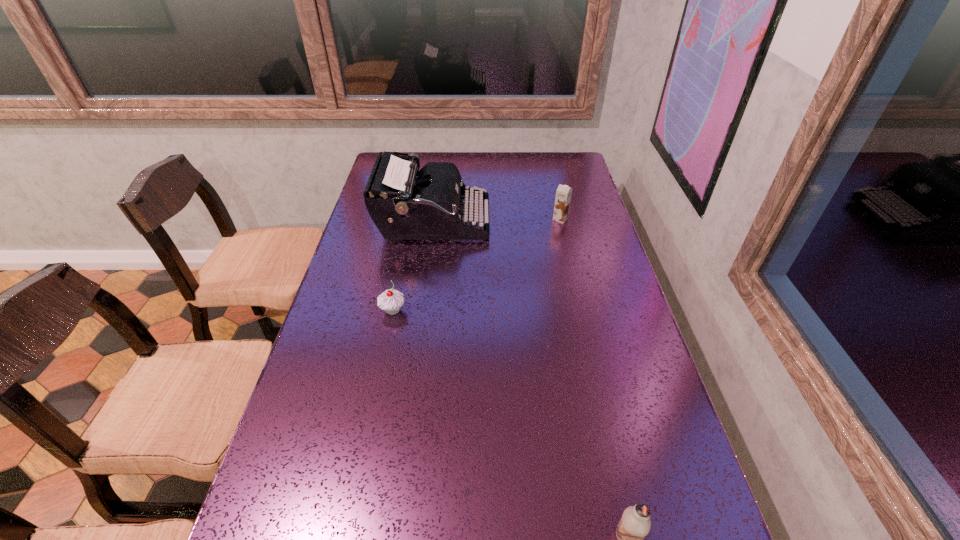
You are a GUI agent. You are given a task and a screenshot of the screen. Output one action in this format:
    pyautogui.click(x=<x>, y=<y>)
    Task: Click on the typewriter
    
    Given the screenshot: What is the action you would take?
    pyautogui.click(x=405, y=203)

Image resolution: width=960 pixels, height=540 pixels. I want to click on the farther chocolate milk, so click(x=563, y=193).

The height and width of the screenshot is (540, 960). Identify the location of cupcake. (391, 300).

Locate an element on the screen. The image size is (960, 540). free spot located 0.080m on the typing side of the typewriter is located at coordinates (512, 222).

I want to click on vacant space located 0.310m on the left of the farther chocolate milk, so click(464, 219).

Identify the location of vacant space situated 0.220m on the front of the second nearest object. The height and width of the screenshot is (540, 960). (377, 390).

Where is `typewriter situated at the left edge`? The image size is (960, 540). typewriter situated at the left edge is located at coordinates (405, 203).

Locate an element on the screen. The height and width of the screenshot is (540, 960). cupcake that is at the left edge is located at coordinates (391, 300).

Identify the location of object that is at the right edge. The image size is (960, 540). (563, 193).

This screenshot has height=540, width=960. I want to click on vacant region at the far edge of the desktop, so click(x=486, y=156).